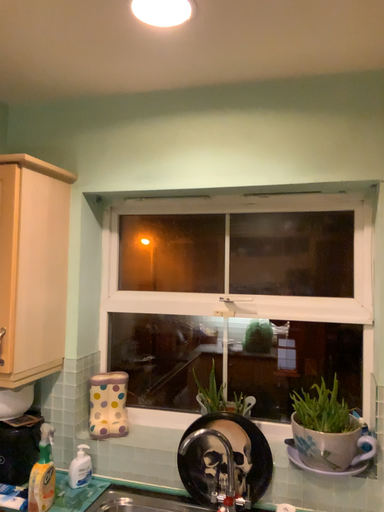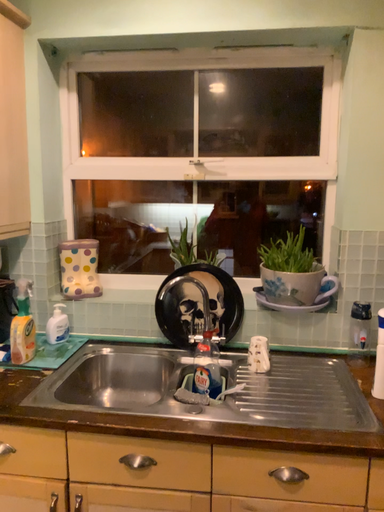
Question: How did the camera likely rotate when shooting the video?

Choices:
 (A) rotated downward
 (B) rotated upward

Answer: (A)